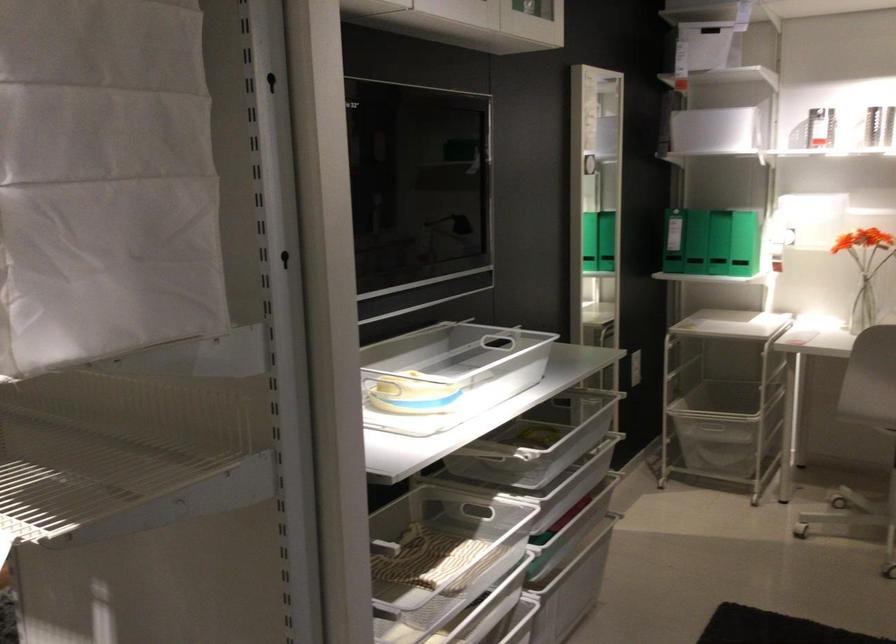
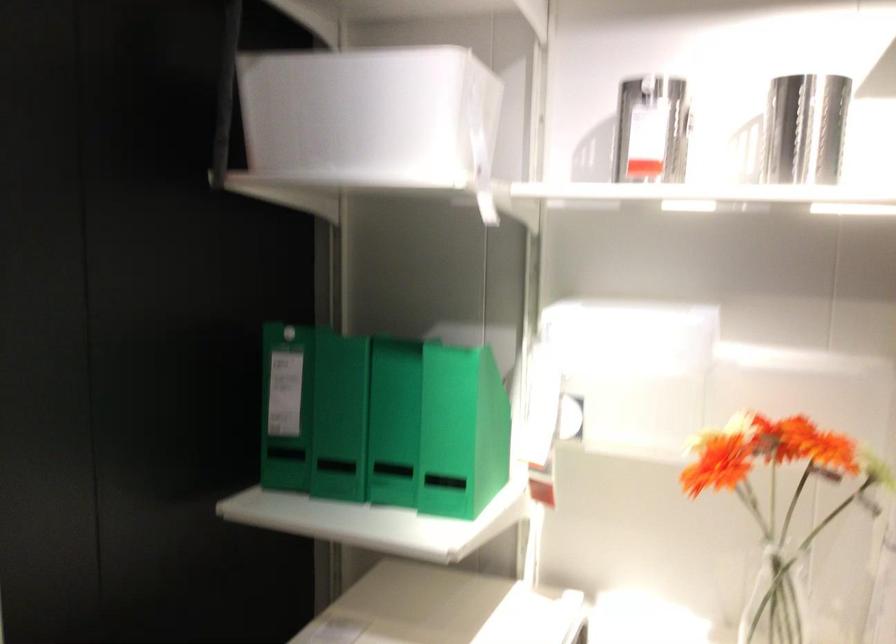
Find the pixel in the second image that matches (739,228) in the first image.

(392, 422)